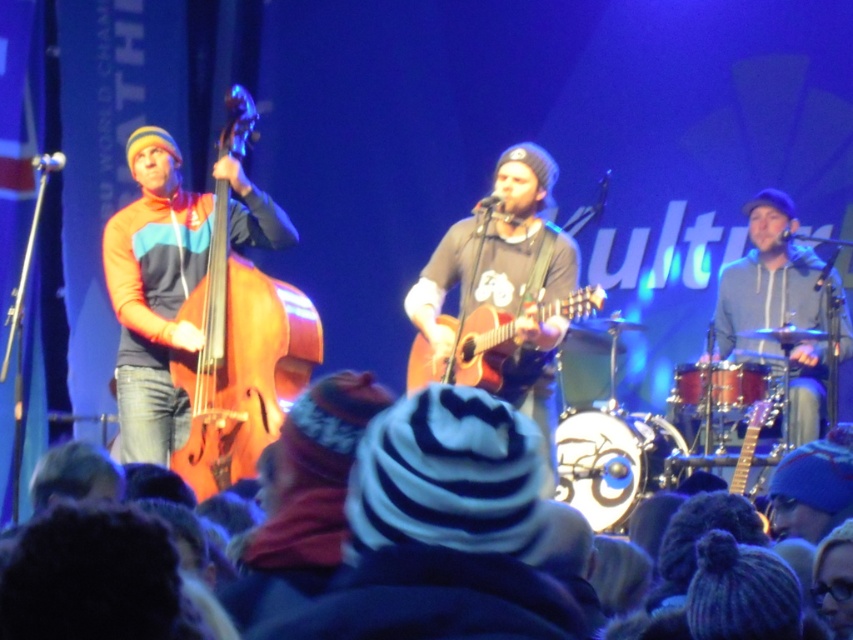
Between point (546, 269) and point (466, 374), which one is positioned behind?

The point (546, 269) is more distant.

The height and width of the screenshot is (640, 853). I want to click on matte brown acoustic guitar at center, so click(x=498, y=250).

Does wooden polished cello at left have a lesser width compared to acoustic wood guitar at center?

Yes, wooden polished cello at left is thinner than acoustic wood guitar at center.

Which is more to the right, wooden polished cello at left or acoustic wood guitar at center?

From the viewer's perspective, acoustic wood guitar at center appears more on the right side.

Where is `wooden polished cello at left`? wooden polished cello at left is located at coordinates (238, 362).

Is wooden polished cello at left thinner than matte brown acoustic guitar at center?

Yes.

Measure the distance between wooden polished cello at left and camera.

wooden polished cello at left is 6.80 meters from camera.

Between point (202, 275) and point (566, 288), which one is positioned in front?

Positioned in front is point (566, 288).

Identify the location of wooden polished cello at left. Image resolution: width=853 pixels, height=640 pixels. (238, 362).